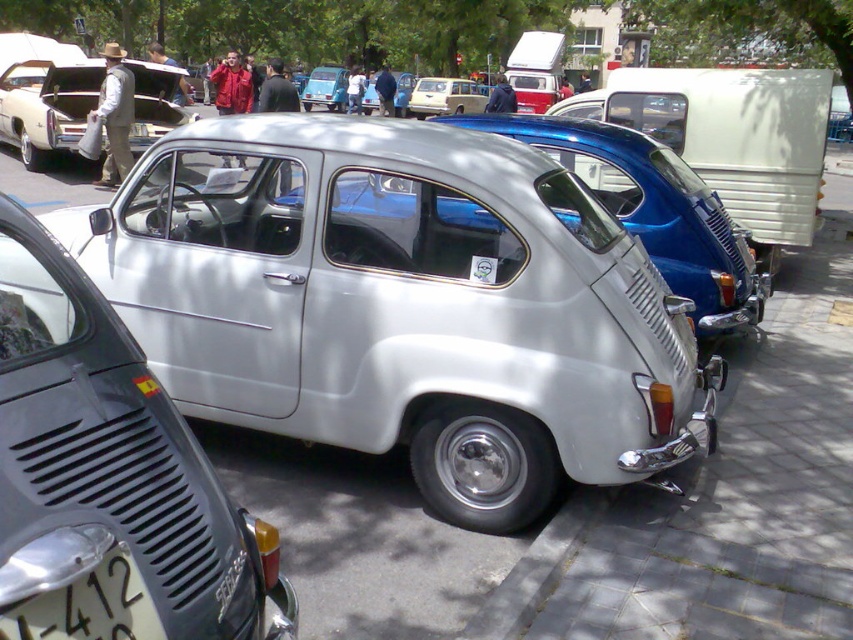
Question: Can you confirm if white plastic license plate at lower left is wider than matte beige van at center?

Choices:
 (A) yes
 (B) no

Answer: (B)

Question: Which object is the closest to the matte beige van at center?

Choices:
 (A) white plastic license plate at lower left
 (B) gray concrete pavement at center
 (C) metallic blue car at center
 (D) white matte car at center

Answer: (C)

Question: Among these points, which one is nearest to the camera?

Choices:
 (A) (459, 106)
 (B) (148, 624)

Answer: (B)

Question: Which object is closer to the camera taking this photo?

Choices:
 (A) metallic silver car at center
 (B) white plastic license plate at lower left
 (C) gray concrete pavement at center
 (D) white matte car at center

Answer: (D)

Question: Is metallic silver car at center below matte white car at center?

Choices:
 (A) no
 (B) yes

Answer: (B)

Question: Does white matte car at center appear on the right side of gray concrete pavement at center?

Choices:
 (A) yes
 (B) no

Answer: (B)